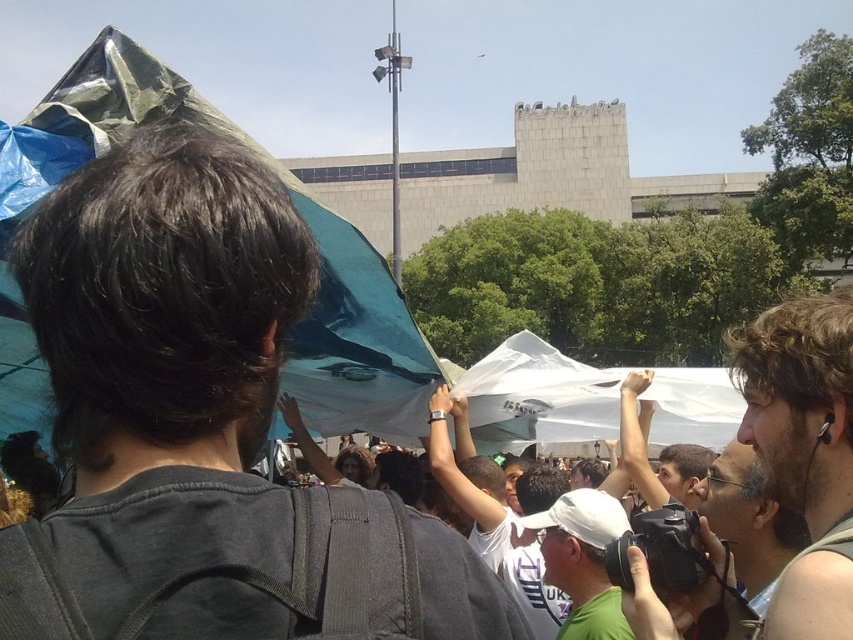
You are a photographer trying to capture a candid shot of the white matte cap at center and the gray tank top at lower right. To ensure both subjects are in focus, you need to know their vertical positions relative to each other. Which one is positioned lower in the frame?

The white matte cap at center is located below the gray tank top at lower right, so the white matte cap at center is positioned lower in the frame.

You are a photographer trying to capture the lively outdoor scene described. You notice the gray fabric earphones at right in the image. To ensure they are included in your shot, where should you position them relative to the edges of your camera frame?

The gray fabric earphones at right are located at point 0.705 on the x and 0.944 on the y coordinates. To include them in your shot, position them near the upper right corner of the camera frame.

You are a photographer trying to capture a detailed shot of the gray fabric earphones at right and the gray tank top at lower right. Which object should you zoom in on to ensure it fills the frame better?

The gray fabric earphones at right is bigger than the gray tank top at lower right, so zooming in on the gray fabric earphones at right will ensure it fills the frame better.